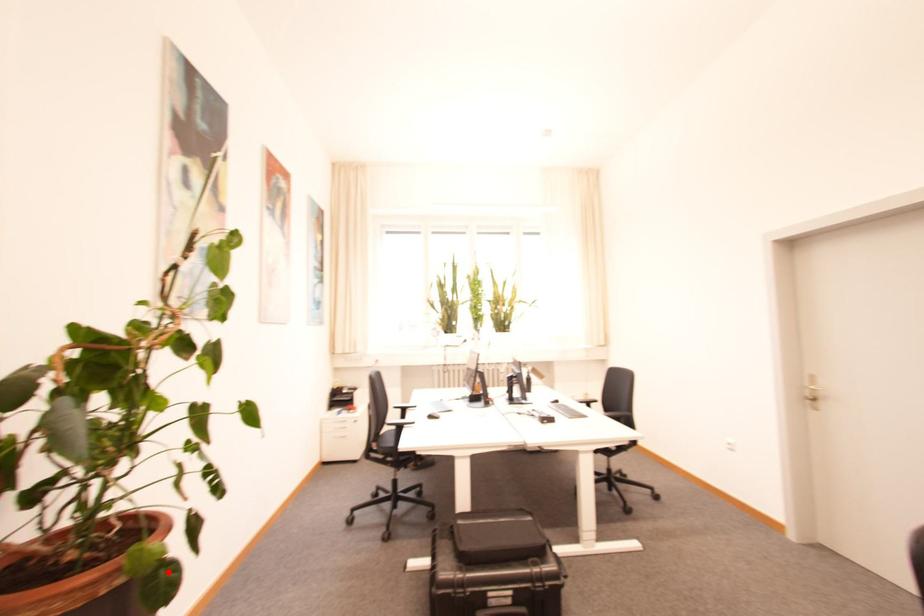
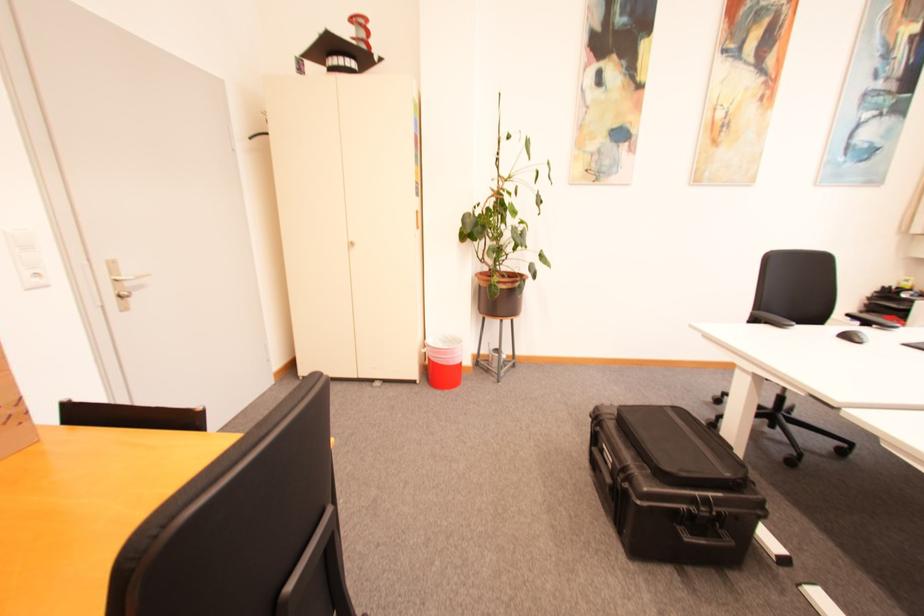
Locate, in the second image, the point that corresponds to the highlighted location in the first image.

(500, 286)